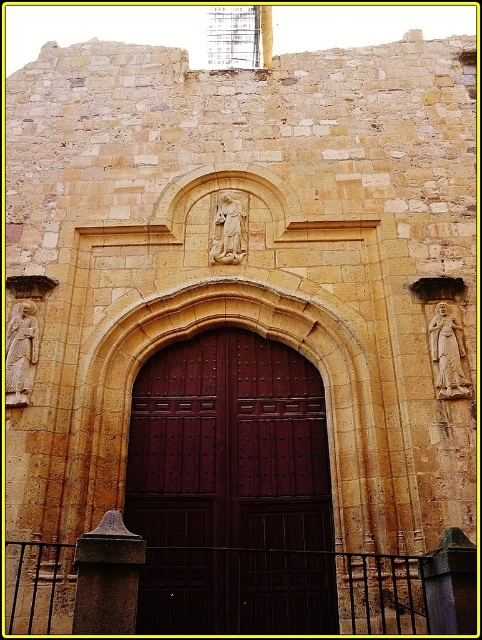
Does dark wood door at center appear on the left side of white stone statue at right?

Correct, you'll find dark wood door at center to the left of white stone statue at right.

Is point (262, 493) positioned after point (436, 365)?

That is False.

At what (x,y) coordinates should I click in order to perform the action: click on dark wood door at center. Please return your answer as a coordinate pair (x, y). Looking at the image, I should click on (230, 490).

Can you confirm if dark wood door at center is positioned below white stone statue at left?

Yes.

Between dark wood door at center and white stone statue at left, which one has more height?

Standing taller between the two is dark wood door at center.

Locate an element on the screen. The width and height of the screenshot is (482, 640). dark wood door at center is located at coordinates (230, 490).

Find the location of a particular element. This screenshot has height=640, width=482. dark wood door at center is located at coordinates (230, 490).

Can you confirm if white stone statue at right is thinner than white marble statue at center?

Yes, white stone statue at right is thinner than white marble statue at center.

Does white stone statue at right have a larger size compared to white marble statue at center?

No, white stone statue at right is not bigger than white marble statue at center.

I want to click on white stone statue at right, so click(x=447, y=353).

Locate an element on the screen. This screenshot has width=482, height=640. white stone statue at right is located at coordinates (447, 353).